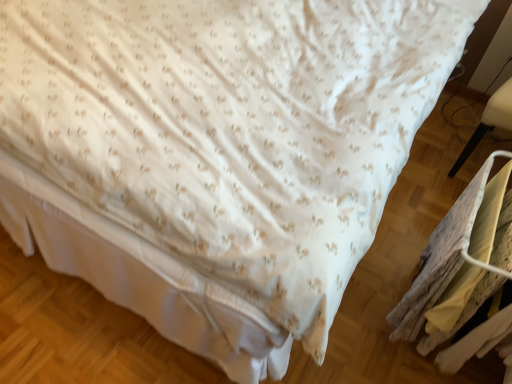
Question: Does yellow fabric laundry at lower right have a lesser width compared to white plastic chair at right?

Choices:
 (A) no
 (B) yes

Answer: (B)

Question: Is yellow fabric laundry at lower right smaller than white plastic chair at right?

Choices:
 (A) yes
 (B) no

Answer: (A)

Question: Is yellow fabric laundry at lower right located outside white plastic chair at right?

Choices:
 (A) no
 (B) yes

Answer: (B)

Question: Does yellow fabric laundry at lower right have a larger size compared to white plastic chair at right?

Choices:
 (A) yes
 (B) no

Answer: (B)

Question: From the image's perspective, is yellow fabric laundry at lower right on top of white plastic chair at right?

Choices:
 (A) no
 (B) yes

Answer: (A)

Question: Is yellow fabric laundry at lower right positioned behind white plastic chair at right?

Choices:
 (A) no
 (B) yes

Answer: (A)

Question: From the image's perspective, does white plastic chair at right appear higher than yellow fabric laundry at lower right?

Choices:
 (A) yes
 (B) no

Answer: (A)

Question: Is the depth of white plastic chair at right less than that of yellow fabric laundry at lower right?

Choices:
 (A) no
 (B) yes

Answer: (A)

Question: Does white plastic chair at right have a greater height compared to yellow fabric laundry at lower right?

Choices:
 (A) yes
 (B) no

Answer: (A)

Question: Is white plastic chair at right bigger than yellow fabric laundry at lower right?

Choices:
 (A) yes
 (B) no

Answer: (A)

Question: Does white plastic chair at right come behind yellow fabric laundry at lower right?

Choices:
 (A) no
 (B) yes

Answer: (B)

Question: From a real-world perspective, is white plastic chair at right beneath yellow fabric laundry at lower right?

Choices:
 (A) yes
 (B) no

Answer: (B)

Question: Based on their sizes in the image, would you say white plastic chair at right is bigger or smaller than yellow fabric laundry at lower right?

Choices:
 (A) big
 (B) small

Answer: (A)